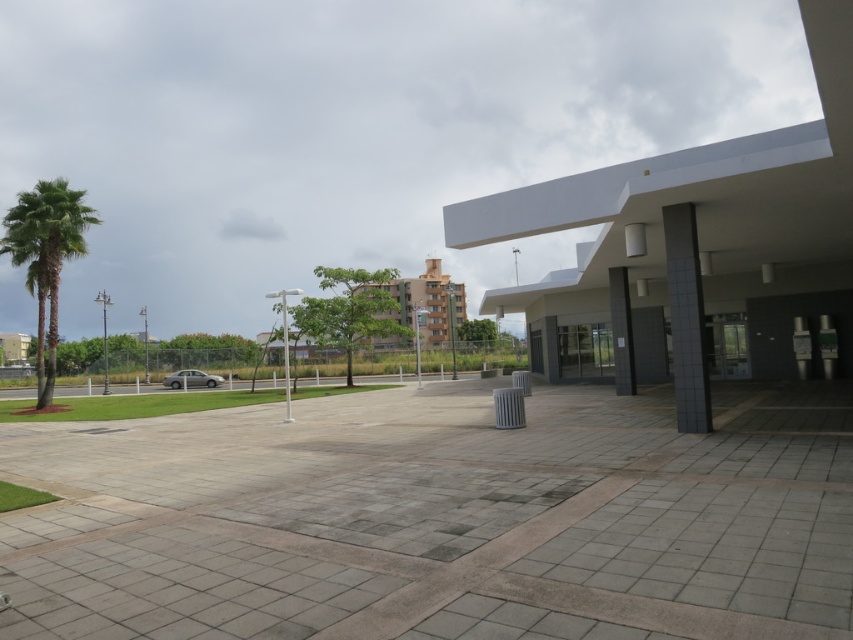
Does green leafy palm tree at left appear on the right side of black tile pillar at center?

In fact, green leafy palm tree at left is to the left of black tile pillar at center.

Does green leafy palm tree at left come in front of black tile pillar at center?

That is False.

Find the location of `green leafy palm tree at left`. green leafy palm tree at left is located at coordinates (45, 259).

Locate an element on the screen. green leafy palm tree at left is located at coordinates (45, 259).

Is point (694, 342) positioned behind point (619, 300)?

No, it is in front of (619, 300).

Can you confirm if black tile pillar at right is bigger than black tile pillar at center?

No.

The height and width of the screenshot is (640, 853). I want to click on black tile pillar at right, so click(x=686, y=320).

Between green leafy palm tree at left and black tile pillar at right, which one is positioned lower?

green leafy palm tree at left

Which is behind, point (49, 346) or point (701, 314)?

Positioned behind is point (49, 346).

Where is `green leafy palm tree at left`? green leafy palm tree at left is located at coordinates (45, 259).